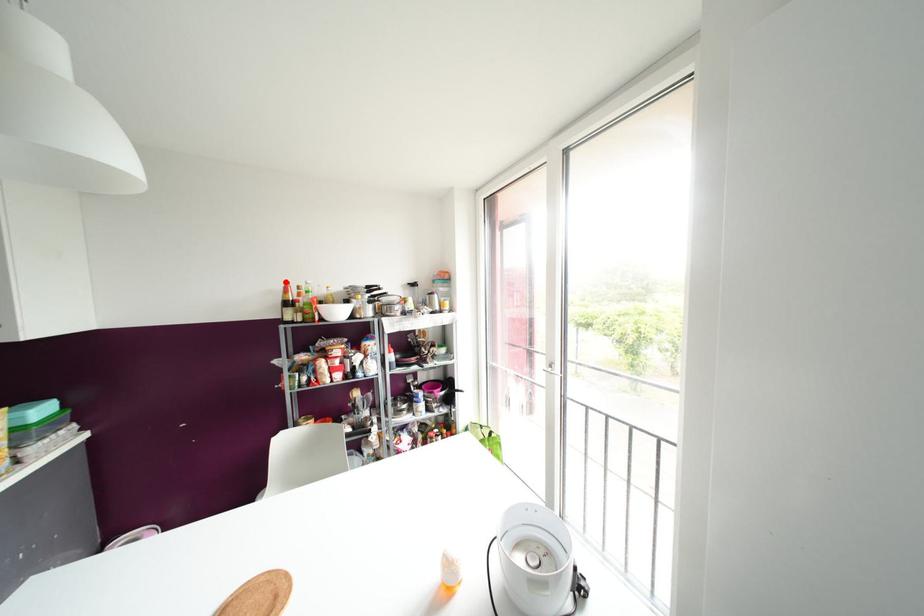
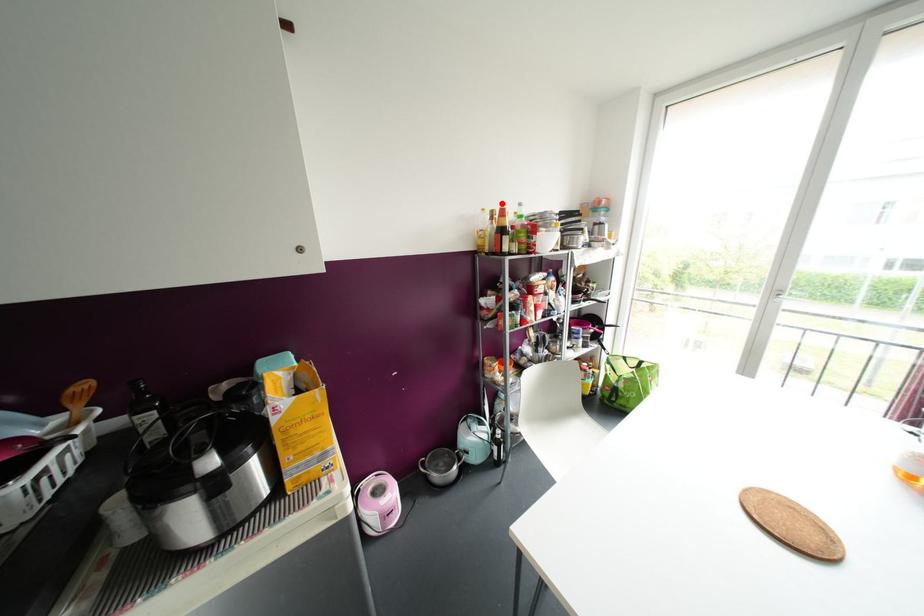
I am providing you with two images of the same scene from different viewpoints. A red point is marked on the first image and another point is marked on the second image. Do the highlighted points in image1 and image2 indicate the same real-world spot?

Yes